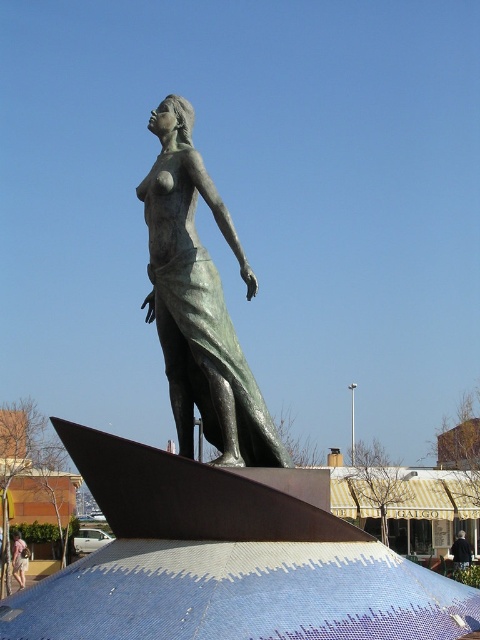
You are an artist planning to paint a scene that includes both the green patina bronze statue at center and the light pink fabric dress at lower left. You want to ensure the statue stands out visually. Which object should you make larger in your painting to emphasize its prominence?

The green patina bronze statue at center is taller than the light pink fabric dress at lower left, so to emphasize its prominence, you should paint the green patina bronze statue at center larger than the light pink fabric dress at lower left.